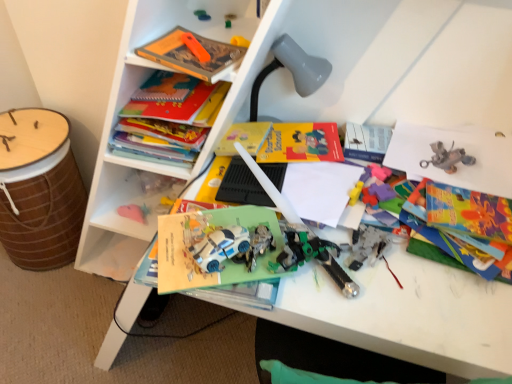
Locate an element on the screen. Image resolution: width=512 pixels, height=384 pixels. free space to the back side of white plastic toy car at center is located at coordinates (227, 217).